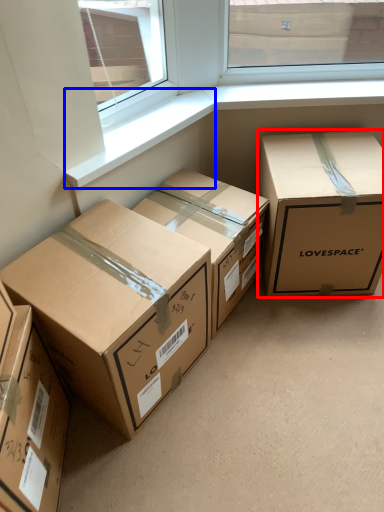
Question: Which point is closer to the camera, box (highlighted by a red box) or window sill (highlighted by a blue box)?

Choices:
 (A) box
 (B) window sill

Answer: (B)